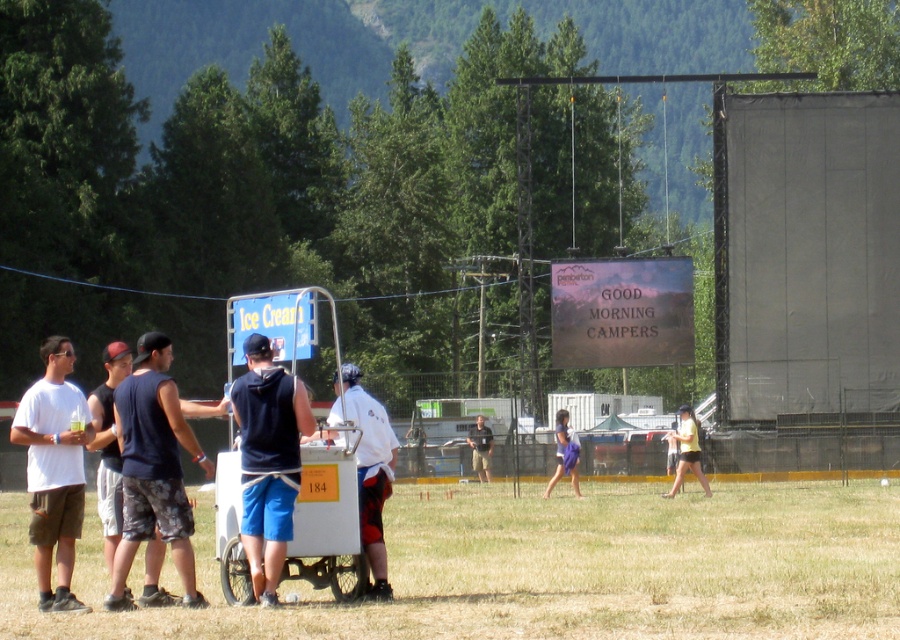
Question: Which point is closer to the camera?

Choices:
 (A) white cotton t-shirt at left
 (B) dark blue fabric shorts at left
 (C) dark gray shirt at center

Answer: (B)

Question: Considering the real-world distances, which object is farthest from the yellow cotton shirt at center?

Choices:
 (A) white cotton t-shirt at left
 (B) white plastic cart at lower center
 (C) dark blue fabric hoodie at center
 (D) white matte shirt at center

Answer: (C)

Question: Does white plastic cart at lower center have a lesser width compared to purple fabric skirt at center?

Choices:
 (A) yes
 (B) no

Answer: (B)

Question: Can you confirm if white plastic cart at lower center is positioned to the right of purple fabric skirt at center?

Choices:
 (A) no
 (B) yes

Answer: (A)

Question: Can you confirm if white matte shirt at center is thinner than dark gray shirt at center?

Choices:
 (A) no
 (B) yes

Answer: (A)

Question: Among these points, which one is farthest from the camera?

Choices:
 (A) (380, 582)
 (B) (63, 483)
 (C) (490, 456)

Answer: (C)